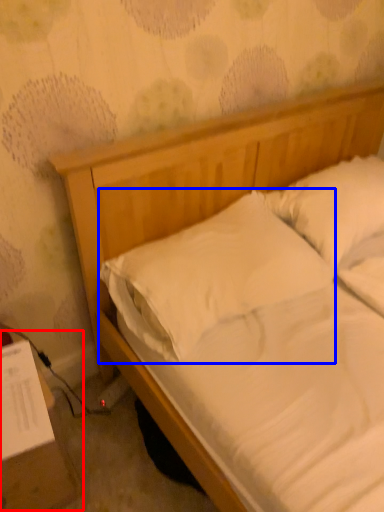
Question: Among these objects, which one is nearest to the camera, table (highlighted by a red box) or pillow (highlighted by a blue box)?

Choices:
 (A) table
 (B) pillow

Answer: (A)